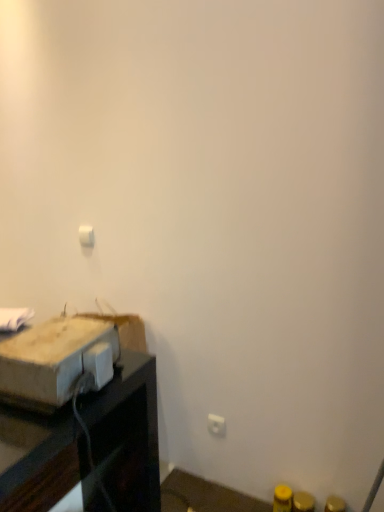
Image resolution: width=384 pixels, height=512 pixels. What do you see at coordinates (86, 236) in the screenshot?
I see `white plastic light switch at upper center` at bounding box center [86, 236].

I want to click on white plastic light switch at upper center, so click(x=86, y=236).

Is the depth of white plastic electric outlet at lower right greater than that of brown cardboard box at left?

Yes, white plastic electric outlet at lower right is further from the viewer.

Is white plastic electric outlet at lower right with brown cardboard box at left?

No, white plastic electric outlet at lower right is not with brown cardboard box at left.

From a real-world perspective, who is located lower, white plastic electric outlet at lower right or brown cardboard box at left?

In real-world perspective, white plastic electric outlet at lower right is lower.

How distant is white plastic electric outlet at lower right from brown cardboard box at left?

The distance of white plastic electric outlet at lower right from brown cardboard box at left is 1.07 meters.

Who is smaller, white plastic light switch at upper center or white plastic electric outlet at lower right?

Smaller between the two is white plastic electric outlet at lower right.

Considering the sizes of objects white plastic light switch at upper center and white plastic electric outlet at lower right in the image provided, who is shorter, white plastic light switch at upper center or white plastic electric outlet at lower right?

Standing shorter between the two is white plastic light switch at upper center.

Is white plastic electric outlet at lower right at the back of white plastic light switch at upper center?

That's not correct — white plastic light switch at upper center is not looking away from white plastic electric outlet at lower right.

Measure the distance from white plastic light switch at upper center to white plastic electric outlet at lower right.

white plastic light switch at upper center is 1.00 meters away from white plastic electric outlet at lower right.

From a real-world perspective, between brown cardboard box at left and white plastic light switch at upper center, who is vertically higher?

white plastic light switch at upper center.

Considering the points (11, 393) and (88, 233), which point is in front, point (11, 393) or point (88, 233)?

The point (11, 393) is in front.

Is brown cardboard box at left far away from white plastic light switch at upper center?

brown cardboard box at left is positioned a significant distance from white plastic light switch at upper center.

Is brown cardboard box at left facing towards white plastic light switch at upper center?

No, brown cardboard box at left is not facing towards white plastic light switch at upper center.

From a real-world perspective, is white plastic light switch at upper center located higher than brown cardboard box at left?

Yes.

Considering the relative sizes of white plastic light switch at upper center and brown cardboard box at left in the image provided, is white plastic light switch at upper center shorter than brown cardboard box at left?

Yes.

Which is behind, point (85, 226) or point (78, 376)?

The point (85, 226) is farther.

Would you say brown cardboard box at left is inside or outside white plastic electric outlet at lower right?

brown cardboard box at left is not inside white plastic electric outlet at lower right, it's outside.

Is brown cardboard box at left to the left of white plastic electric outlet at lower right from the viewer's perspective?

Yes.

Is brown cardboard box at left wider or thinner than white plastic electric outlet at lower right?

Considering their sizes, brown cardboard box at left looks broader than white plastic electric outlet at lower right.

Does point (49, 337) come behind point (216, 431)?

That is False.

Looking at this image, is white plastic electric outlet at lower right taller than white plastic light switch at upper center?

Yes.

Based on the photo, is white plastic electric outlet at lower right placed right next to white plastic light switch at upper center?

No, white plastic electric outlet at lower right is not touching white plastic light switch at upper center.

Consider the image. Is white plastic electric outlet at lower right positioned with its back to white plastic light switch at upper center?

No, white plastic light switch at upper center is not at the back of white plastic electric outlet at lower right.

Measure the distance from white plastic electric outlet at lower right to white plastic light switch at upper center.

3.29 feet.

Image resolution: width=384 pixels, height=512 pixels. In the image, there is a brown cardboard box at left. Identify the location of electric outlet below it (from the image's perspective). (216, 425).

I want to click on light switch behind the white plastic electric outlet at lower right, so click(x=86, y=236).

Estimate the real-world distances between objects in this image. Which object is further from white plastic light switch at upper center, white plastic electric outlet at lower right or brown cardboard box at left?

The object further to white plastic light switch at upper center is brown cardboard box at left.

Looking at the image, which one is located closer to brown cardboard box at left, white plastic electric outlet at lower right or white plastic light switch at upper center?

Based on the image, white plastic light switch at upper center appears to be nearer to brown cardboard box at left.

Looking at the image, which one is located further to white plastic electric outlet at lower right, brown cardboard box at left or white plastic light switch at upper center?

brown cardboard box at left is further to white plastic electric outlet at lower right.

Looking at the image, which one is located further to white plastic electric outlet at lower right, white plastic light switch at upper center or brown cardboard box at left?

brown cardboard box at left is positioned further to the anchor white plastic electric outlet at lower right.

Which object lies further to the anchor point brown cardboard box at left, white plastic light switch at upper center or white plastic electric outlet at lower right?

white plastic electric outlet at lower right is positioned further to the anchor brown cardboard box at left.

Estimate the real-world distances between objects in this image. Which object is closer to white plastic light switch at upper center, brown cardboard box at left or white plastic electric outlet at lower right?

white plastic electric outlet at lower right lies closer to white plastic light switch at upper center than the other object.

Image resolution: width=384 pixels, height=512 pixels. Find the location of `electric outlet between brown cardboard box at left and white plastic light switch at upper center from front to back`. electric outlet between brown cardboard box at left and white plastic light switch at upper center from front to back is located at coordinates (216, 425).